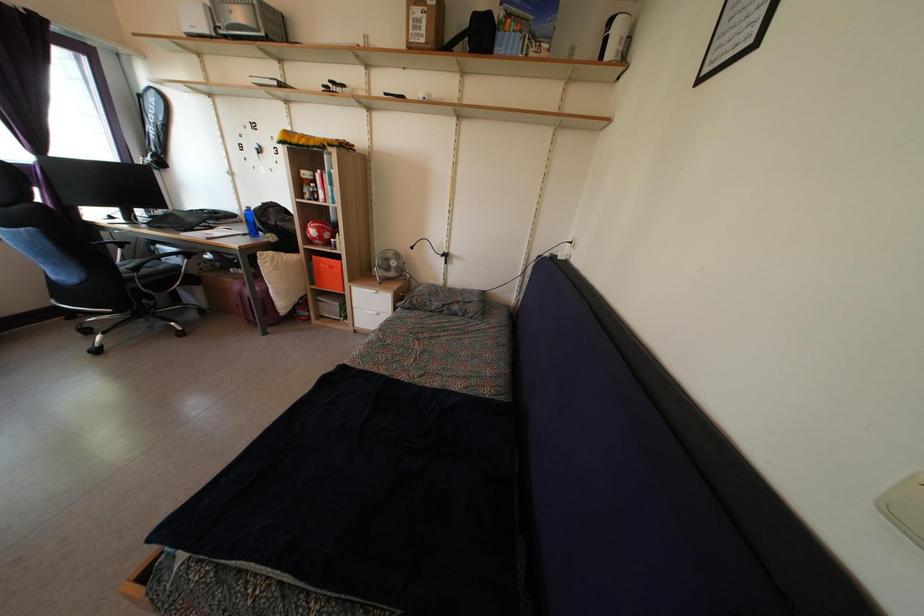
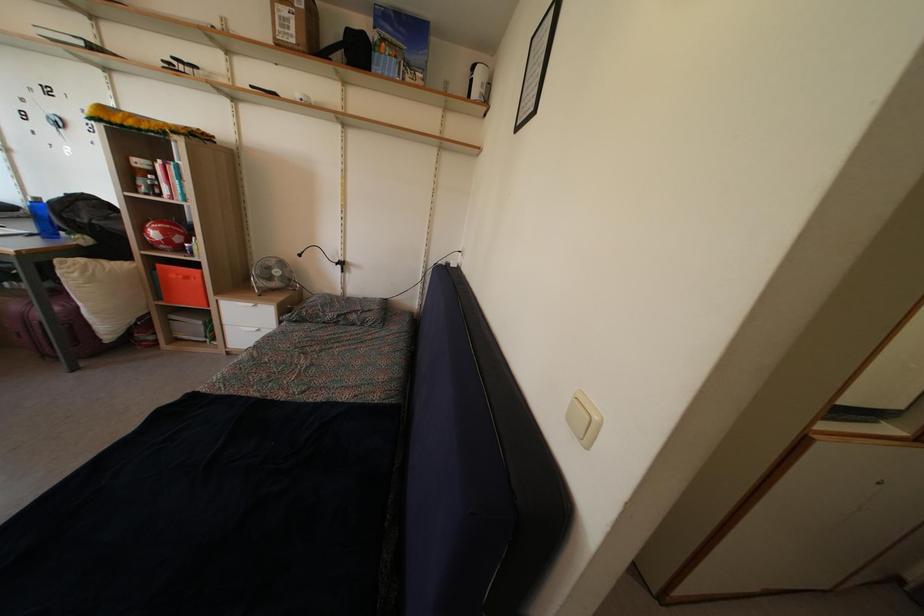
Find the pixel in the second image that matches (x=444, y=291) in the first image.

(342, 301)